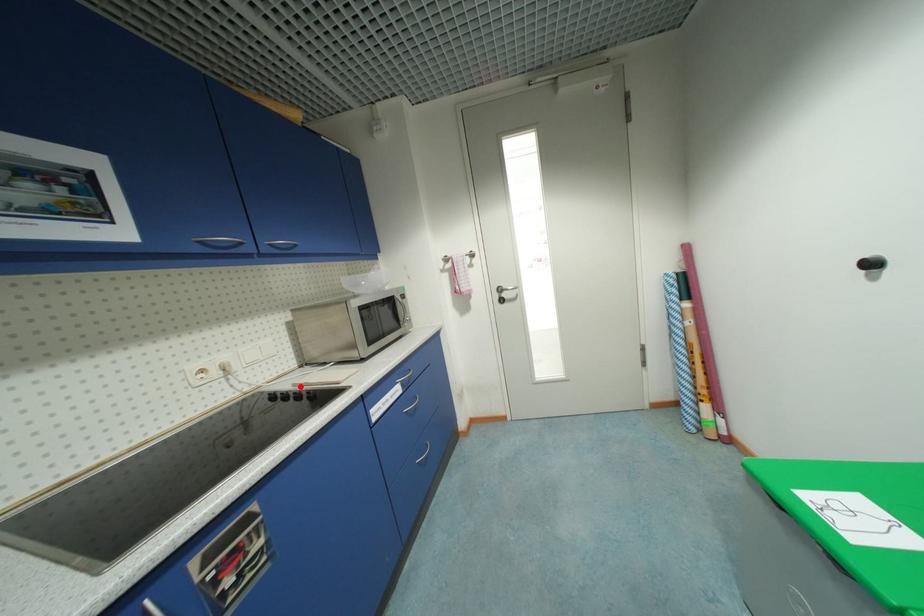
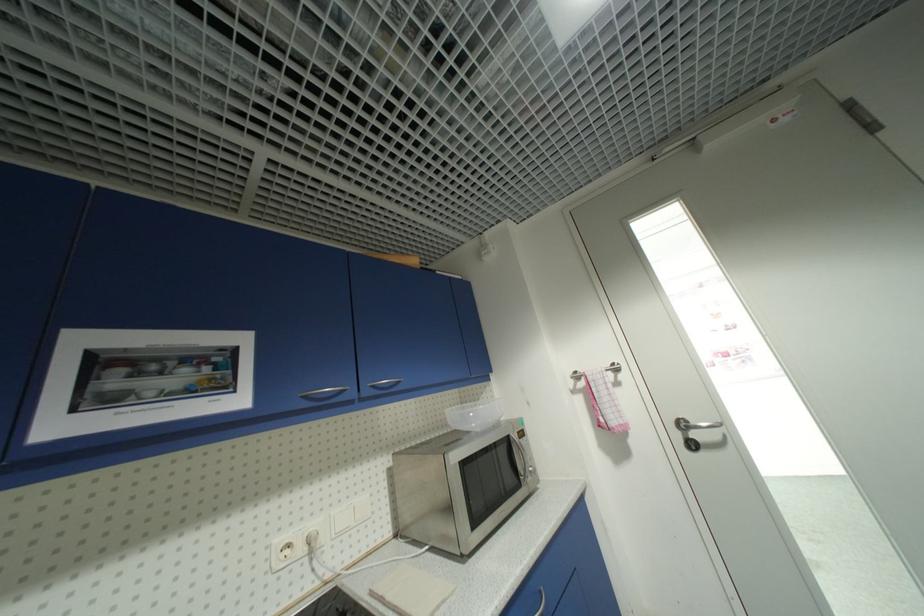
Locate, in the second image, the point that corresponds to the highlighted location in the first image.

(378, 594)